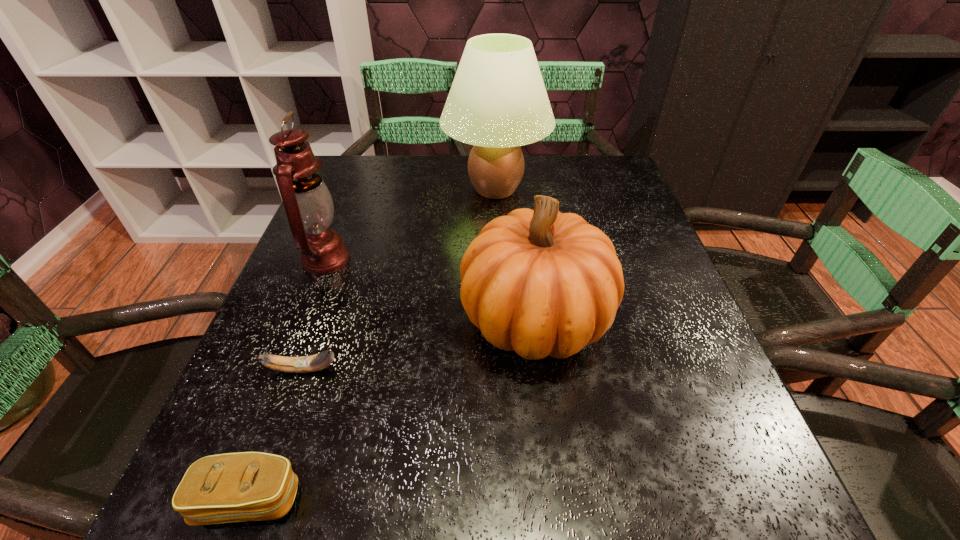
Locate an element on the screen. free spot located at the stem of the banana is located at coordinates (430, 369).

Image resolution: width=960 pixels, height=540 pixels. What are the coordinates of `object situated at the far edge` in the screenshot? It's located at (497, 102).

Find the location of a particular element. object positioned at the near edge is located at coordinates (248, 486).

At what (x,y) coordinates should I click in order to perform the action: click on oil lamp that is at the left edge. Please return your answer as a coordinate pair (x, y). Image resolution: width=960 pixels, height=540 pixels. Looking at the image, I should click on (308, 204).

The image size is (960, 540). Identify the location of banana that is at the left edge. (303, 364).

Find the location of a particular element. clutch bag that is at the left edge is located at coordinates (248, 486).

Locate an element on the screen. This screenshot has width=960, height=540. object located at the right edge is located at coordinates (539, 282).

Locate an element on the screen. object that is at the near left corner is located at coordinates (248, 486).

This screenshot has width=960, height=540. I want to click on free space at the far edge of the desktop, so click(x=428, y=160).

You are a GUI agent. You are given a task and a screenshot of the screen. Output one action in this format:
    pyautogui.click(x=<x>, y=<y>)
    Task: Click on the free space at the near edge of the desktop
    The width and height of the screenshot is (960, 540).
    Given the screenshot: What is the action you would take?
    pyautogui.click(x=588, y=485)